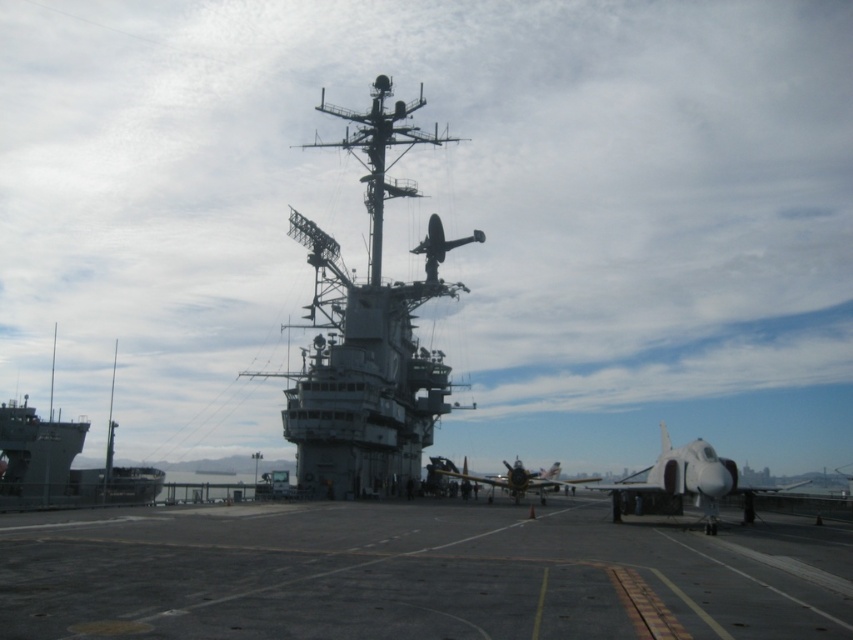
You are a naval officer planning to move the gray metallic ship at center and the white glossy jet at center to a new location. Given their sizes, which one would require more space in terms of width when moving them side by side?

The white glossy jet at center requires more space in terms of width when moving them side by side because the gray metallic ship at center has a lesser width compared to the white glossy jet at center.

You are a drone operator controlling a drone that needs to land on the gray metallic ship at left. The drone has a maximum landing radius of 0.05 units from point (62, 465). Is the landing point within the drone landing radius?

The gray metallic ship at left is located exactly at point (62, 465), so the drone can land there since the point is within its maximum landing radius of 0.05 units.